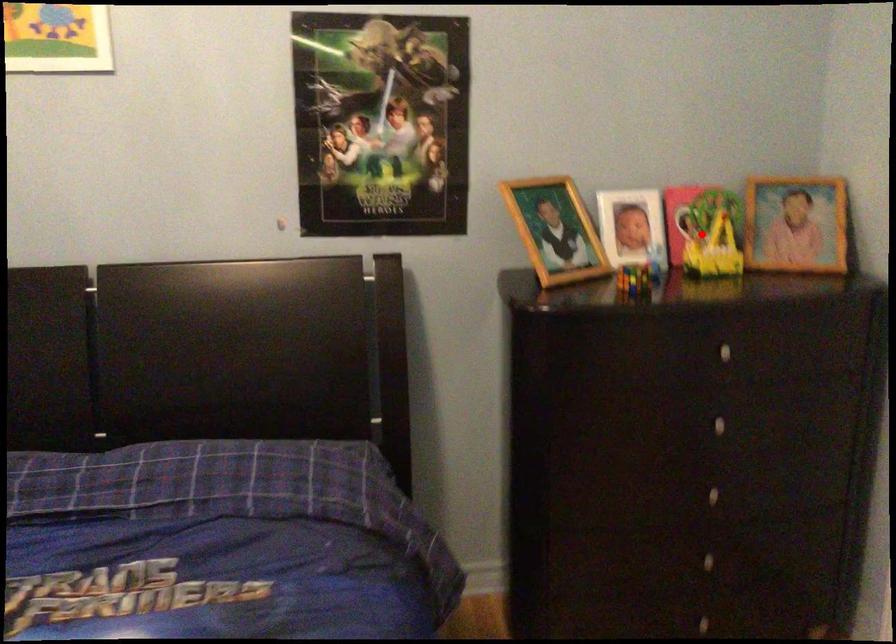
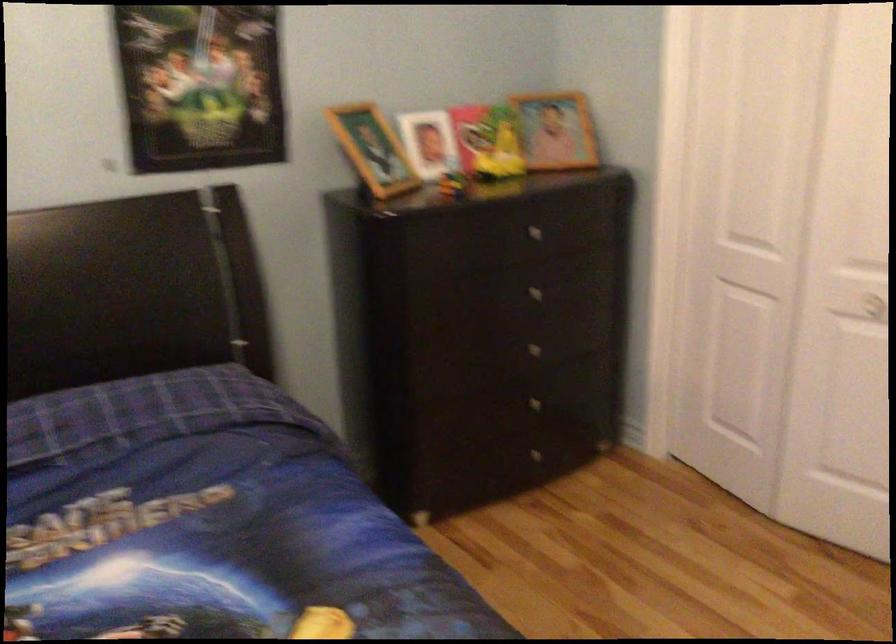
Question: I am providing you with two images of the same scene from different viewpoints. In image1, a red point is highlighted. Considering the same 3D point in image2, which of the following is correct?

Choices:
 (A) It is closer
 (B) It is farther

Answer: (B)